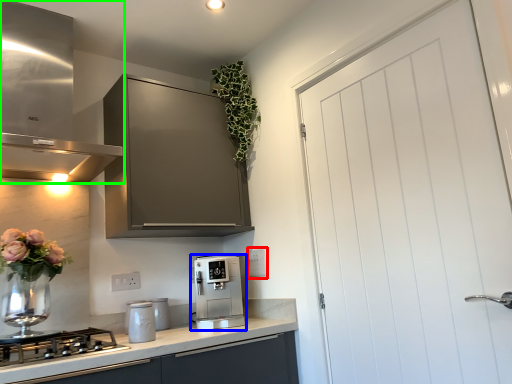
Question: Estimate the real-world distances between objects in this image. Which object is farther from electric outlet (highlighted by a red box), kitchen appliance (highlighted by a blue box) or home appliance (highlighted by a green box)?

Choices:
 (A) kitchen appliance
 (B) home appliance

Answer: (B)